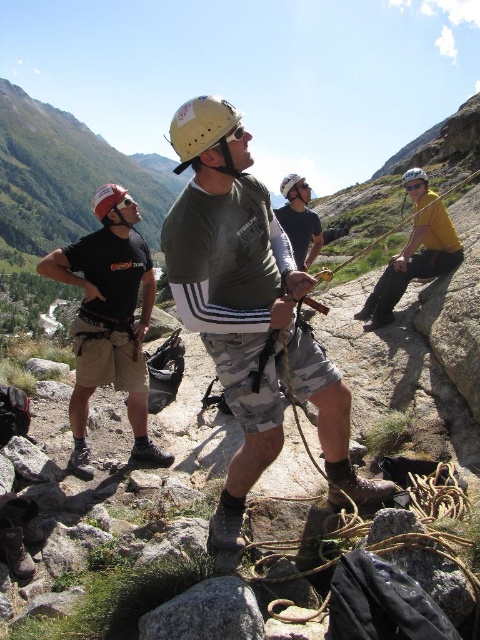
Which is more to the left, matte black t-shirt at left or white matte helmet at center?

matte black t-shirt at left

Is matte black t-shirt at left positioned before white matte helmet at center?

That is True.

Identify the location of matte black t-shirt at left. The height and width of the screenshot is (640, 480). (108, 321).

Does matte green shirt at center appear over yellow matte shirt at right?

Indeed, matte green shirt at center is positioned over yellow matte shirt at right.

In the scene shown: Is matte green shirt at center shorter than yellow matte shirt at right?

No, matte green shirt at center is not shorter than yellow matte shirt at right.

The height and width of the screenshot is (640, 480). Find the location of `matte green shirt at center`. matte green shirt at center is located at coordinates (249, 310).

Image resolution: width=480 pixels, height=640 pixels. Find the location of `matte green shirt at center`. matte green shirt at center is located at coordinates tap(249, 310).

Who is higher up, yellow matte shirt at right or white matte helmet at center?

white matte helmet at center

Between point (460, 244) and point (285, 192), which one is positioned in front?

Point (460, 244) is more forward.

Is point (381, 284) positioned behind point (291, 172)?

No, it is not.

This screenshot has height=640, width=480. Find the location of `yellow matte shirt at right`. yellow matte shirt at right is located at coordinates (415, 256).